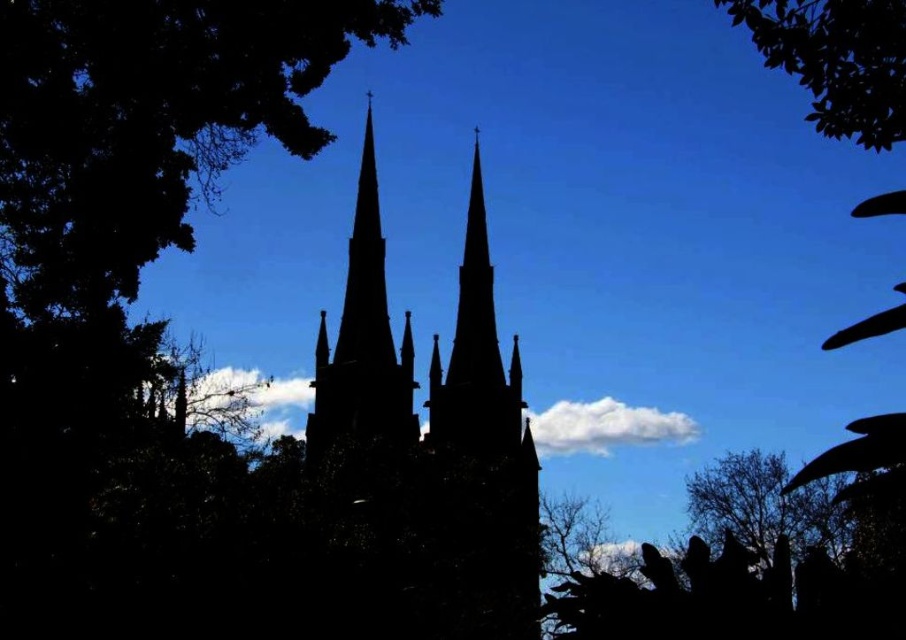
Between silhouette church at center and silhouette stone tower at center, which one appears on the right side from the viewer's perspective?

silhouette church at center is more to the right.

Does silhouette church at center appear over silhouette stone tower at center?

Incorrect, silhouette church at center is not positioned above silhouette stone tower at center.

This screenshot has width=906, height=640. What do you see at coordinates (437, 420) in the screenshot?
I see `silhouette church at center` at bounding box center [437, 420].

This screenshot has height=640, width=906. I want to click on silhouette church at center, so click(437, 420).

Does silhouette church at center appear on the left side of silhouette leafy tree at lower right?

Indeed, silhouette church at center is positioned on the left side of silhouette leafy tree at lower right.

What do you see at coordinates (437, 420) in the screenshot?
I see `silhouette church at center` at bounding box center [437, 420].

Between point (500, 632) and point (715, 540), which one is positioned behind?

Positioned behind is point (715, 540).

Identify the location of silhouette church at center. (437, 420).

Is silhouette stone tower at center below silhouette leafy tree at lower right?

No, silhouette stone tower at center is not below silhouette leafy tree at lower right.

Who is more forward, (371, 324) or (730, 500)?

Positioned in front is point (371, 324).

In order to click on silhouette stone tower at center in this screenshot , I will do point(362,340).